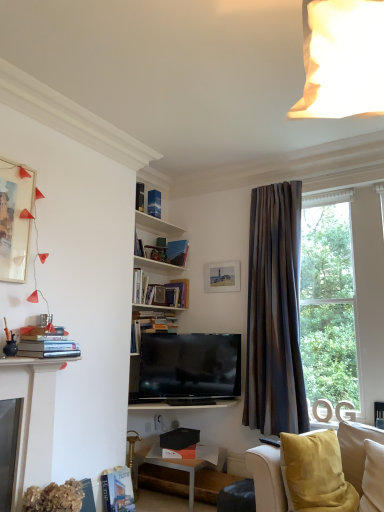
Question: Visually, is blue paper book at upper center, the fourth book viewed from the front, positioned to the left or to the right of hardcover book at lower left, the sixth book from the top?

Choices:
 (A) left
 (B) right

Answer: (B)

Question: From a real-world perspective, relative to hardcover book at lower left, the 2th book when ordered from front to back, is blue paper book at upper center, the fourth book viewed from the front, vertically above or below?

Choices:
 (A) below
 (B) above

Answer: (B)

Question: Which object is positioned closest to the blue paper book at upper center, the fourth book viewed from the front?

Choices:
 (A) white glossy table at lower center
 (B) hardcover book at upper center, the third book viewed from the front
 (C) matte white picture frame at upper left, which is counted as the 2th picture frame, starting from the right
 (D) hardcover book at lower left, the 1th book positioned from the bottom
 (E) velvet yellow couch at lower right

Answer: (B)

Question: Which of these objects is positioned farthest from the blue paper book at upper center, acting as the 3th book starting from the back?

Choices:
 (A) hardcover book at center, arranged as the 2th book when viewed from the back
 (B) hardcover book at upper center, which ranks as the first book in top-to-bottom order
 (C) hardcover book at center, which is the fourth book in bottom-to-top order
 (D) velvet yellow couch at lower right
 (E) white glossy table at lower center

Answer: (D)